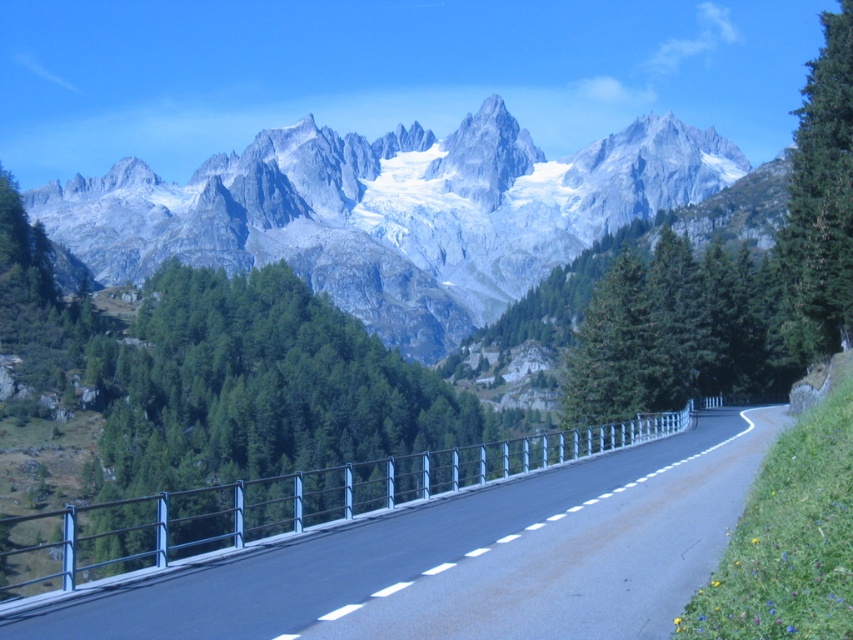
You are standing at the edge of a mountain cliff overlooking the black asphalt road at center. A hiker approaches you and asks how far the road is from where you are standing. What do you tell them?

The black asphalt road at center is 23.30 meters away from the viewer, so you can inform the hiker that the road is approximately 23.30 meters away from your current position.